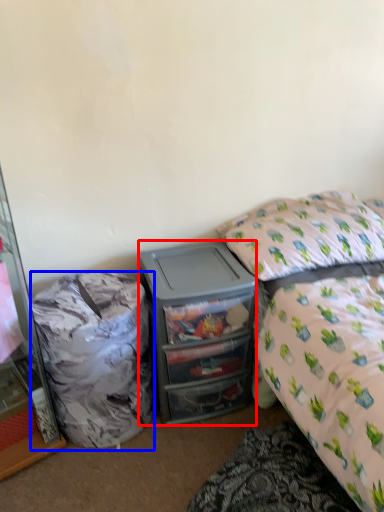
Question: Which point is further to the camera, desk (highlighted by a red box) or trash bin/can (highlighted by a blue box)?

Choices:
 (A) desk
 (B) trash bin/can

Answer: (A)